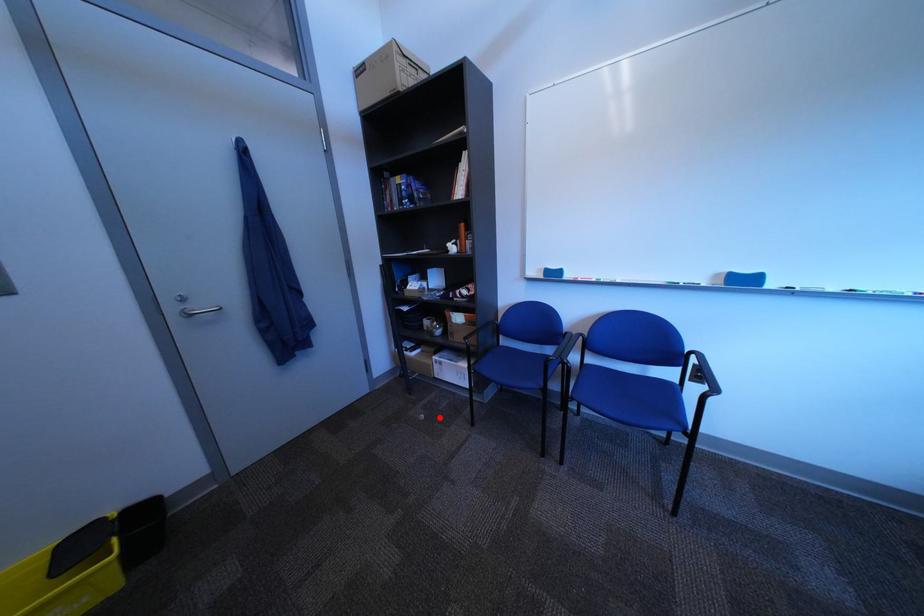
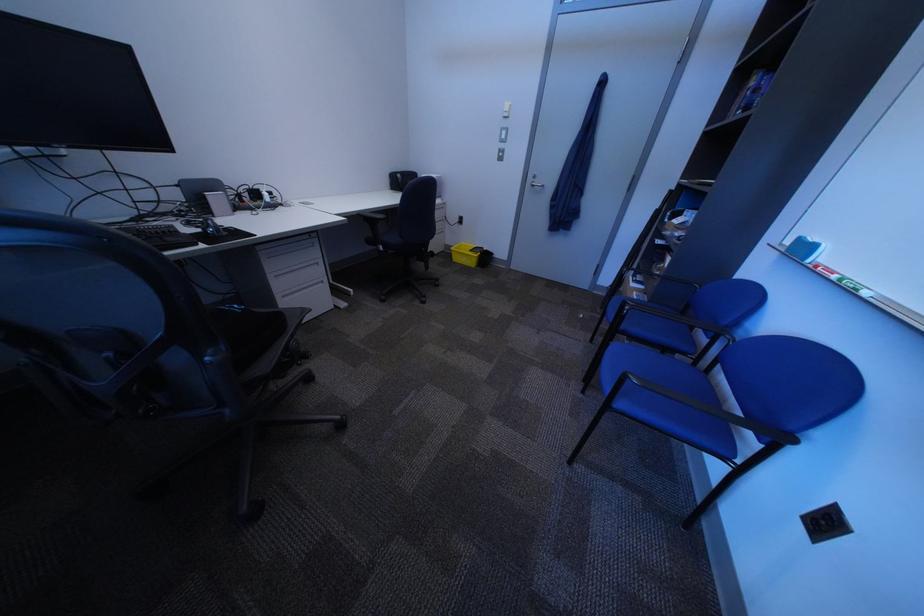
Locate, in the second image, the point that corresponds to the highlighted location in the first image.

(599, 318)